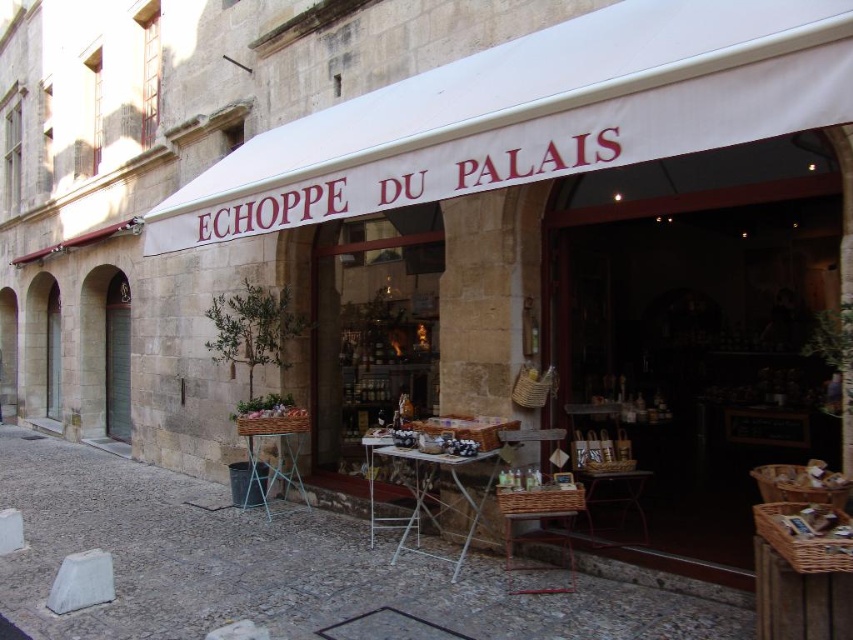
Question: Where is wooden folding table at center located in relation to metallic folding table at center in the image?

Choices:
 (A) above
 (B) below

Answer: (B)

Question: Is wooden folding table at center further to camera compared to metallic folding table at center?

Choices:
 (A) yes
 (B) no

Answer: (B)

Question: Does wooden crates at center appear on the left side of metallic folding table at center?

Choices:
 (A) yes
 (B) no

Answer: (A)

Question: Which of the following is the farthest from the observer?

Choices:
 (A) white fabric canopy at upper center
 (B) wooden folding table at center
 (C) metallic folding table at center
 (D) wooden crates at center

Answer: (C)

Question: Based on their relative distances, which object is farther from the wooden folding table at center?

Choices:
 (A) wooden crates at center
 (B) white fabric canopy at upper center
 (C) metallic folding table at center

Answer: (B)

Question: Which of these objects is positioned closest to the metallic folding table at center?

Choices:
 (A) white fabric canopy at upper center
 (B) wooden crates at center
 (C) wooden folding table at center

Answer: (B)